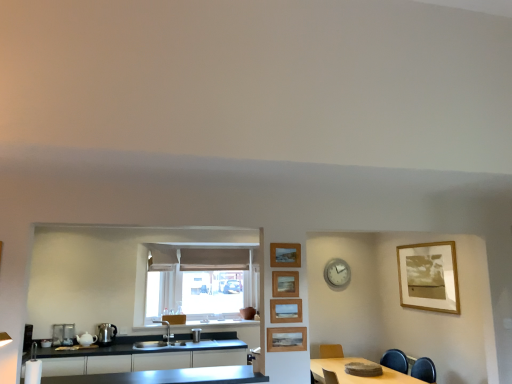
Question: Can you confirm if wooden framed photo at upper right, which is the 1th picture frame in right-to-left order, is bigger than wooden table at lower right?

Choices:
 (A) no
 (B) yes

Answer: (A)

Question: Is wooden framed photo at upper right, the 5th picture frame positioned from the front, wider than wooden table at lower right?

Choices:
 (A) yes
 (B) no

Answer: (B)

Question: Is wooden framed photo at upper right, the 5th picture frame positioned from the front, oriented away from wooden table at lower right?

Choices:
 (A) yes
 (B) no

Answer: (B)

Question: Is wooden framed photo at upper right, which appears as the fifth picture frame when viewed from the left, smaller than wooden table at lower right?

Choices:
 (A) yes
 (B) no

Answer: (A)

Question: Is wooden framed photo at upper right, which is the 1th picture frame in right-to-left order, located outside wooden table at lower right?

Choices:
 (A) no
 (B) yes

Answer: (B)

Question: Is satin silver faucet at center, the 1th appliance in the right-to-left sequence, bigger or smaller than metallic silver toaster at lower left, the first appliance positioned from the left?

Choices:
 (A) big
 (B) small

Answer: (B)

Question: In terms of width, does satin silver faucet at center, the 1th appliance in the right-to-left sequence, look wider or thinner when compared to metallic silver toaster at lower left, the first appliance positioned from the left?

Choices:
 (A) wide
 (B) thin

Answer: (A)

Question: In the image, is satin silver faucet at center, the 1th appliance in the right-to-left sequence, on the left side or the right side of metallic silver toaster at lower left, the first appliance positioned from the left?

Choices:
 (A) right
 (B) left

Answer: (A)

Question: Does point (193, 329) appear closer or farther from the camera than point (58, 331)?

Choices:
 (A) closer
 (B) farther

Answer: (B)

Question: Does point (338, 259) appear closer or farther from the camera than point (70, 342)?

Choices:
 (A) farther
 (B) closer

Answer: (A)

Question: From the image's perspective, is white metallic clock at upper center located above or below metallic silver toaster at lower left, the 3th appliance from the right?

Choices:
 (A) below
 (B) above

Answer: (B)

Question: From a real-world perspective, relative to metallic silver toaster at lower left, the 3th appliance from the right, is white metallic clock at upper center vertically above or below?

Choices:
 (A) above
 (B) below

Answer: (A)

Question: Considering the positions of white metallic clock at upper center and metallic silver toaster at lower left, the 3th appliance from the right, in the image, is white metallic clock at upper center bigger or smaller than metallic silver toaster at lower left, the 3th appliance from the right,?

Choices:
 (A) big
 (B) small

Answer: (A)

Question: Is point (199, 332) positioned closer to the camera than point (46, 382)?

Choices:
 (A) closer
 (B) farther

Answer: (B)

Question: Is satin silver faucet at center, the 3th appliance from the left, taller or shorter than stainless steel countertop at lower center?

Choices:
 (A) tall
 (B) short

Answer: (A)